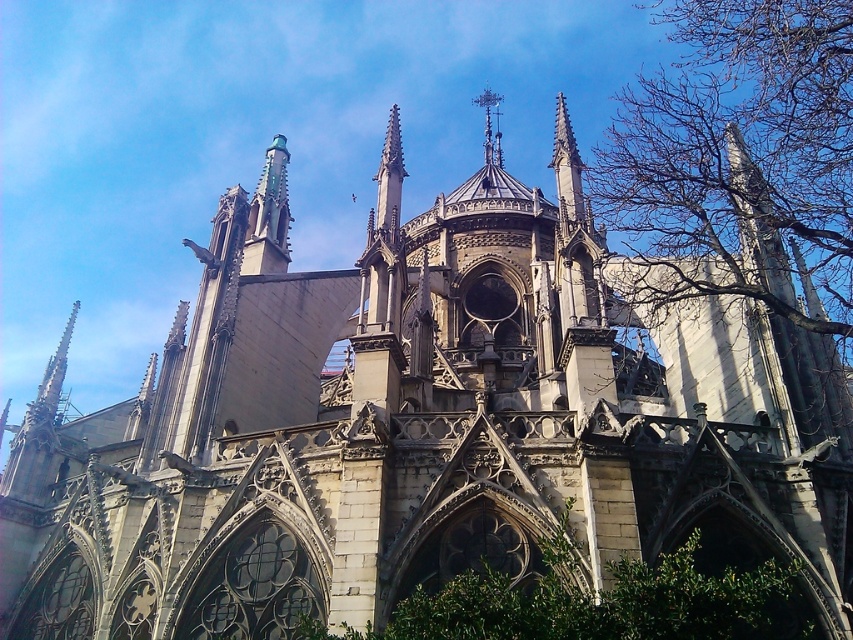
You are standing in front of the cathedral and notice a bare branches at upper right and a green leafy bush at lower center. Which of these two plants is located to the right of the other?

The bare branches at upper right is positioned on the right side of green leafy bush at lower center.

You are an architect analyzing the cathedral in the image. You notice the bare branches at upper right and the green leafy bush at lower center. Which of these two elements is larger in size?

The bare branches at upper right is bigger than the green leafy bush at lower center.

You are standing in front of the cathedral and notice a specific point marked at coordinates point (746, 145). Based on the scene description, what is located at this point?

The point (746, 145) marks bare branches at upper right.